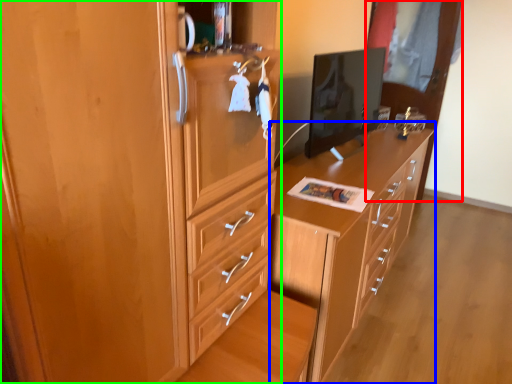
Question: Which is farther away from glass door (highlighted by a red box)? chest of drawers (highlighted by a blue box) or cabinetry (highlighted by a green box)?

Choices:
 (A) chest of drawers
 (B) cabinetry

Answer: (B)